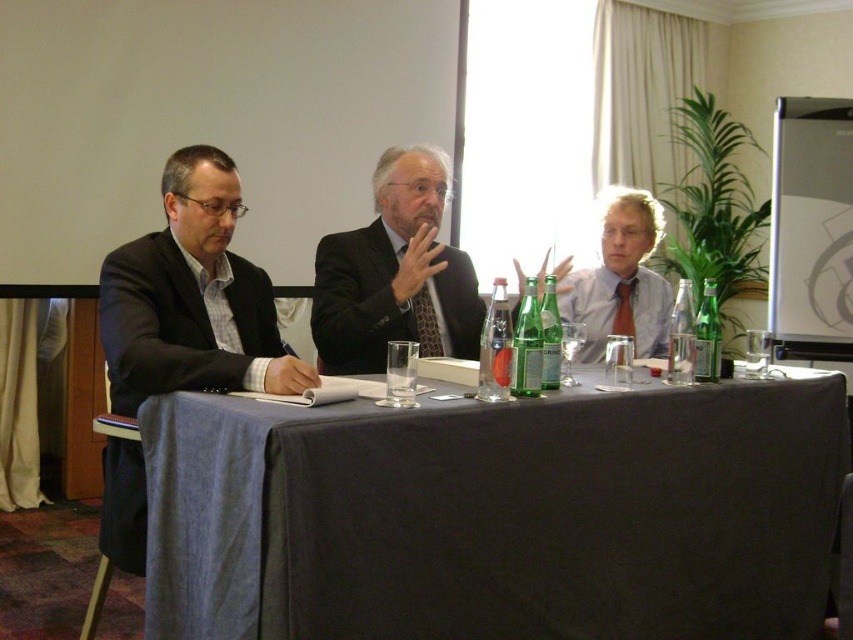
You are a guest at this meeting and need to place your name tag on the table. Can you place it directly above the black fabric table at center without it overlapping the matte black shirt at center?

The black fabric table at center is below the matte black shirt at center, so placing the name tag directly above the table would position it under the shirt, causing overlap. Choose a spot further down on the table instead.

You are standing in front of the table in the conference room. There are two points marked on the table surface at coordinates point (372, 589) and point (657, 237). If you want to place a small object on the table, which point is closer to you?

Point (372, 589) is closer to the camera than point (657, 237), so placing the object there would be closer to you.